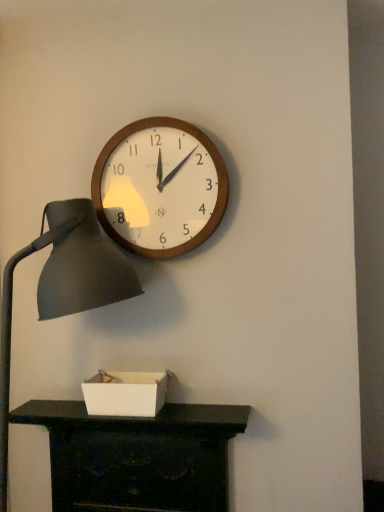
Question: From the image's perspective, is matte black desk at lower center above wooden wall clock at upper center?

Choices:
 (A) no
 (B) yes

Answer: (A)

Question: Is matte black desk at lower center not close to wooden wall clock at upper center?

Choices:
 (A) yes
 (B) no

Answer: (B)

Question: Does matte black desk at lower center have a smaller size compared to wooden wall clock at upper center?

Choices:
 (A) yes
 (B) no

Answer: (B)

Question: Is matte black desk at lower center closer to the viewer compared to wooden wall clock at upper center?

Choices:
 (A) no
 (B) yes

Answer: (B)

Question: Is matte black desk at lower center completely or partially outside of wooden wall clock at upper center?

Choices:
 (A) yes
 (B) no

Answer: (A)

Question: Is matte black desk at lower center oriented away from wooden wall clock at upper center?

Choices:
 (A) yes
 (B) no

Answer: (B)

Question: Does matte black desk at lower center appear on the left side of white cardboard box at lower center?

Choices:
 (A) no
 (B) yes

Answer: (B)

Question: From a real-world perspective, is matte black desk at lower center positioned over white cardboard box at lower center based on gravity?

Choices:
 (A) no
 (B) yes

Answer: (A)

Question: Considering the relative sizes of matte black desk at lower center and white cardboard box at lower center in the image provided, is matte black desk at lower center taller than white cardboard box at lower center?

Choices:
 (A) no
 (B) yes

Answer: (B)

Question: From a real-world perspective, is matte black desk at lower center physically below white cardboard box at lower center?

Choices:
 (A) no
 (B) yes

Answer: (B)

Question: Does matte black desk at lower center have a larger size compared to white cardboard box at lower center?

Choices:
 (A) yes
 (B) no

Answer: (A)

Question: Is matte black desk at lower center with white cardboard box at lower center?

Choices:
 (A) yes
 (B) no

Answer: (B)

Question: Does matte black lamp at left have a greater height compared to wooden wall clock at upper center?

Choices:
 (A) no
 (B) yes

Answer: (B)